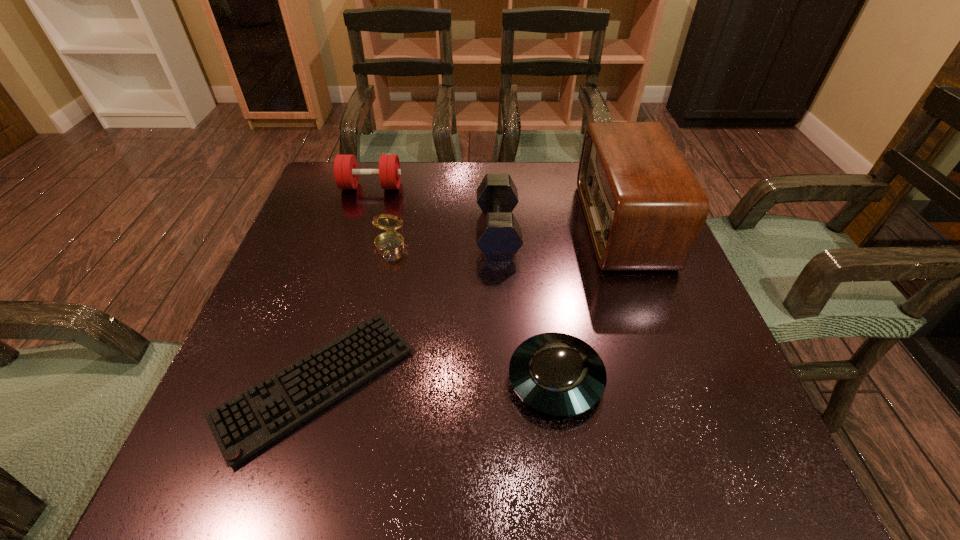
Where is `vacant space situated on the back of the right dumbbell`? vacant space situated on the back of the right dumbbell is located at coordinates (494, 163).

You are a GUI agent. You are given a task and a screenshot of the screen. Output one action in this format:
    pyautogui.click(x=<x>, y=<y>)
    Task: Click on the vacant area situated 0.180m on the right of the left dumbbell
    This screenshot has height=540, width=960.
    Given the screenshot: What is the action you would take?
    pyautogui.click(x=468, y=186)

At what (x,y) coordinates should I click in order to perform the action: click on free spot located with the dial facing the compass. Please return your answer as a coordinate pair (x, y). This screenshot has width=960, height=540. Looking at the image, I should click on (371, 334).

Where is `vacant region located 0.400m on the back of the saucer`? vacant region located 0.400m on the back of the saucer is located at coordinates (533, 213).

Where is `vacant position located on the back of the computer keyboard`? vacant position located on the back of the computer keyboard is located at coordinates (348, 274).

This screenshot has width=960, height=540. I want to click on radio receiver located in the far edge section of the desktop, so click(x=644, y=208).

Identify the location of object present at the near edge. The height and width of the screenshot is (540, 960). (243, 425).

Identify the location of dumbbell that is at the left edge. (346, 173).

The width and height of the screenshot is (960, 540). Find the location of `computer keyboard that is at the left edge`. computer keyboard that is at the left edge is located at coordinates (243, 425).

You are a GUI agent. You are given a task and a screenshot of the screen. Output one action in this format:
    pyautogui.click(x=<x>, y=<y>)
    Task: Click on the object positioned at the right edge
    
    Given the screenshot: What is the action you would take?
    pyautogui.click(x=644, y=208)